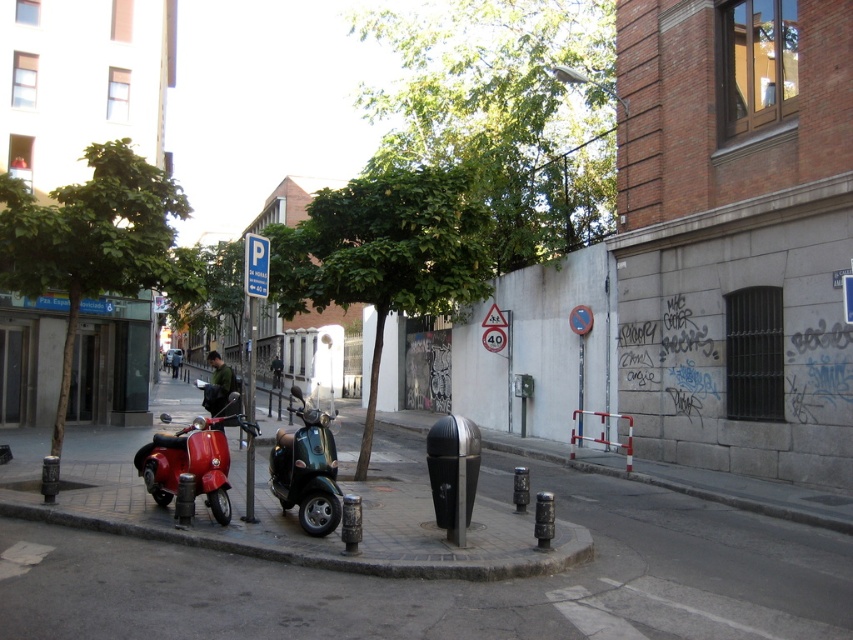
Question: Considering the real-world distances, which object is closest to the metallic green scooter at center?

Choices:
 (A) green leafy tree at left
 (B) green leafy tree at upper center

Answer: (A)

Question: Which of these objects is positioned farthest from the metallic green scooter at center?

Choices:
 (A) green leafy tree at upper center
 (B) smooth concrete pavement at center
 (C) shiny red scooter at lower left

Answer: (A)

Question: From the image, what is the correct spatial relationship of green leafy tree at upper center in relation to green leafy tree at center?

Choices:
 (A) right
 (B) left

Answer: (B)

Question: Does green leafy tree at center have a lesser width compared to metallic green scooter at center?

Choices:
 (A) yes
 (B) no

Answer: (A)

Question: Does smooth concrete pavement at center appear over green leafy tree at left?

Choices:
 (A) yes
 (B) no

Answer: (B)

Question: Which point is farther from the camera taking this photo?

Choices:
 (A) (422, 486)
 (B) (299, 260)
 (C) (177, 205)
 (D) (312, 496)

Answer: (B)